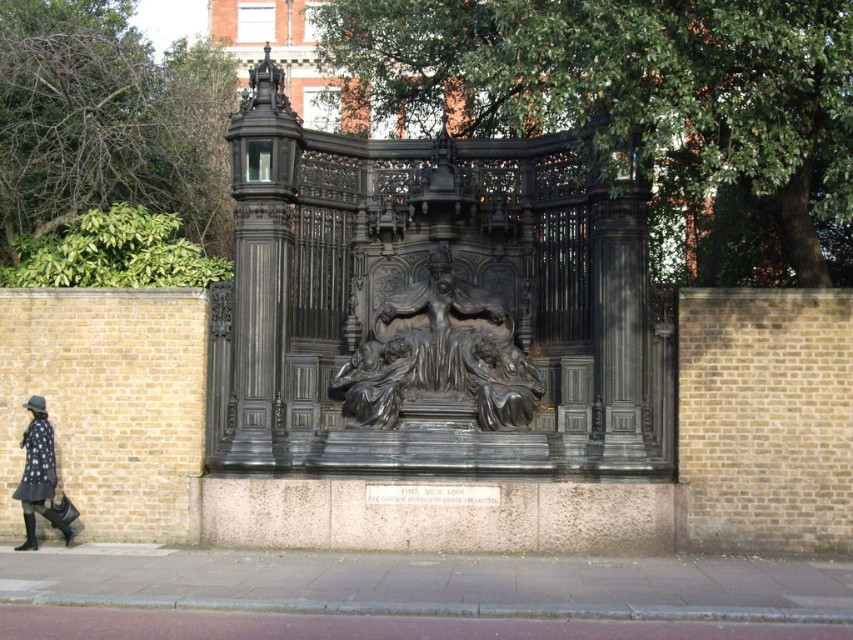
You are standing in front of the black metal gate between two light brown brick walls. You see a point marked at coordinates (x=439, y=355). What object is located at this point?

The point at (x=439, y=355) corresponds to the black polished stone sculpture at center.

You are standing in front of the black metal gate and want to take a photo of the polka dot dress at lower left. Which direction should you move to ensure the black polished stone sculpture at center is not blocking your view?

Result: Move to the left so that the polka dot dress at lower left is visible without the black polished stone sculpture at center blocking it, as the sculpture is to the right of the dress.